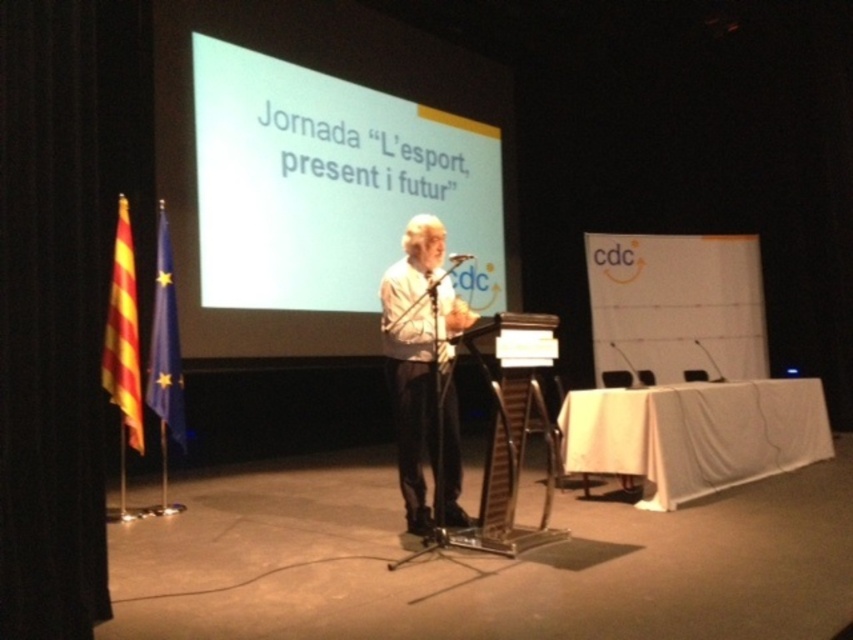
Question: Considering the real-world distances, which object is closest to the white matte shirt at center?

Choices:
 (A) metallic silver microphone at center
 (B) white matte projection screen at center

Answer: (A)

Question: In this image, where is white matte shirt at center located relative to metallic silver microphone at center?

Choices:
 (A) below
 (B) above

Answer: (A)

Question: Is the position of white matte projection screen at center more distant than that of metallic silver microphone at center?

Choices:
 (A) yes
 (B) no

Answer: (A)

Question: Which point appears farthest from the camera in this image?

Choices:
 (A) (456, 252)
 (B) (397, 296)

Answer: (A)

Question: Can you confirm if white matte shirt at center is positioned to the right of metallic silver microphone at center?

Choices:
 (A) yes
 (B) no

Answer: (B)

Question: Among these objects, which one is farthest from the camera?

Choices:
 (A) metallic silver microphone at center
 (B) white matte shirt at center

Answer: (A)